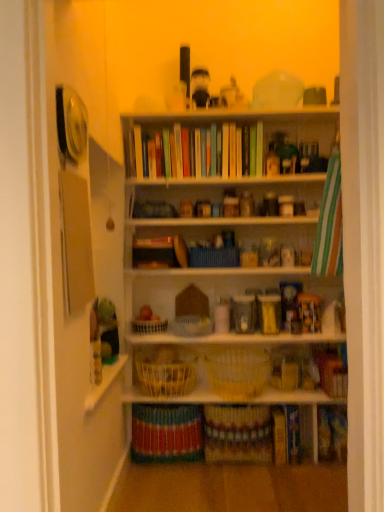
Question: Considering the positions of woven brown basket at center, which appears as the first basket when viewed from the top, and white woven basket at center, which is the fourth basket in bottom-to-top order, in the image, is woven brown basket at center, which appears as the first basket when viewed from the top, taller or shorter than white woven basket at center, which is the fourth basket in bottom-to-top order,?

Choices:
 (A) tall
 (B) short

Answer: (A)

Question: Would you say woven brown basket at center, marked as the 5th basket in a bottom-to-top arrangement, is inside or outside white woven basket at center, the 2th basket when ordered from top to bottom?

Choices:
 (A) outside
 (B) inside

Answer: (A)

Question: Considering the real-world distances, which object is closest to the multicolored woven basket at lower center, the first book when ordered from left to right?

Choices:
 (A) green plush toy at lower left
 (B) white matte bookcase at center
 (C) white woven basket at center, which appears as the fourth basket when viewed from the top
 (D) matte brown book at lower right, which is the first book from right to left
 (E) white woven basket at center, which is the third basket from top to bottom

Answer: (C)

Question: Estimate the real-world distances between objects in this image. Which object is closer to the white woven basket at center, the second basket positioned from the bottom?

Choices:
 (A) woven brown basket at center, which appears as the first basket when viewed from the top
 (B) white woven basket at center, which ranks as the 3th basket in bottom-to-top order
 (C) hardcover book at lower right, which is the 2th book in right-to-left order
 (D) multicolored woven basket at lower center, the first book when ordered from left to right
 (E) matte brown book at lower right, placed as the 3th book when sorted from left to right

Answer: (C)